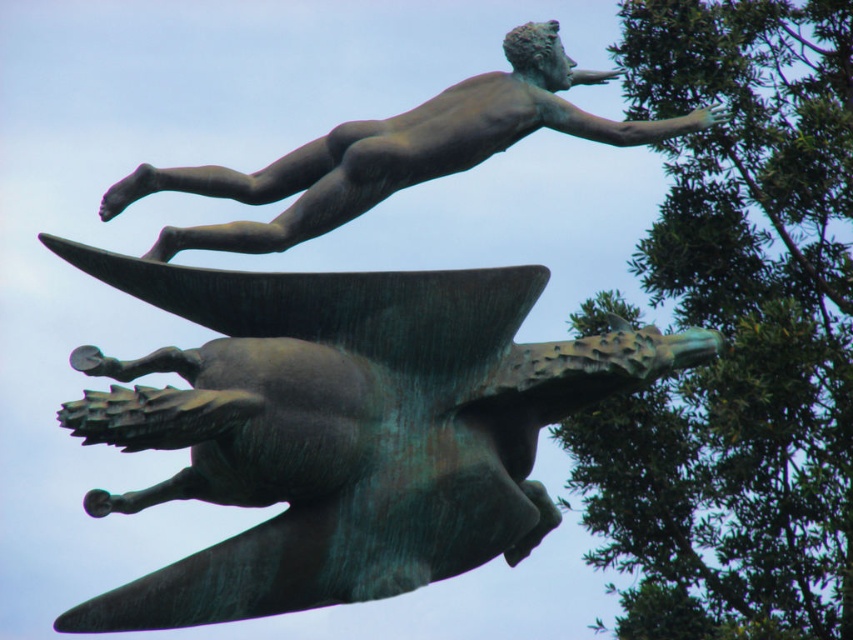
Does green leafy tree at upper right appear on the right side of bronze statue at upper center?

Indeed, green leafy tree at upper right is positioned on the right side of bronze statue at upper center.

Does green leafy tree at upper right appear on the left side of bronze statue at upper center?

No, green leafy tree at upper right is not to the left of bronze statue at upper center.

Is point (732, 593) positioned after point (281, 234)?

Yes, it is.

Where is `green leafy tree at upper right`? This screenshot has width=853, height=640. green leafy tree at upper right is located at coordinates (737, 333).